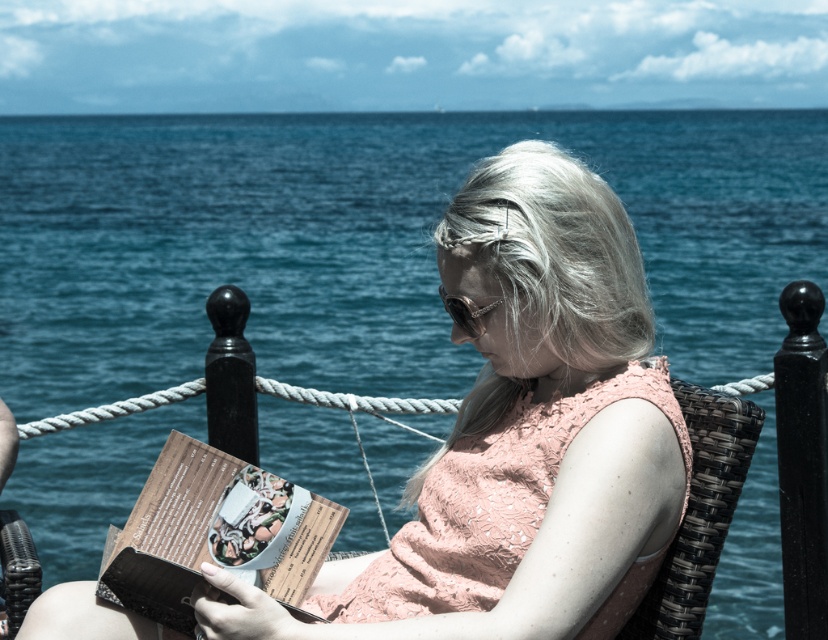
Is matte brown book at center to the left of woven rattan chair at center from the viewer's perspective?

Indeed, matte brown book at center is positioned on the left side of woven rattan chair at center.

Is point (172, 467) positioned after point (711, 428)?

Yes, point (172, 467) is farther from viewer.

Find the location of a particular element. matte brown book at center is located at coordinates click(213, 532).